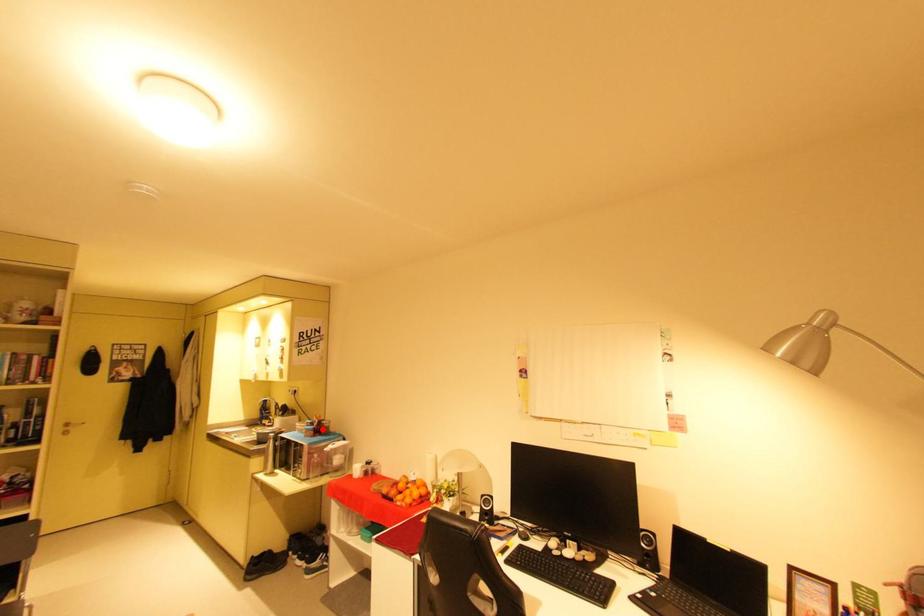
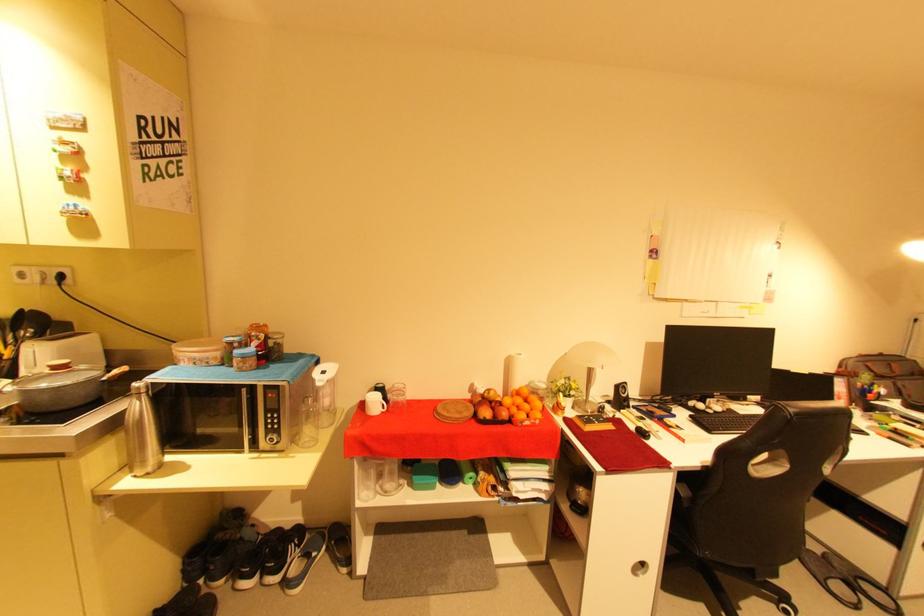
The point at the highlighted location is marked in the first image. Where is the corresponding point in the second image?

(265, 352)